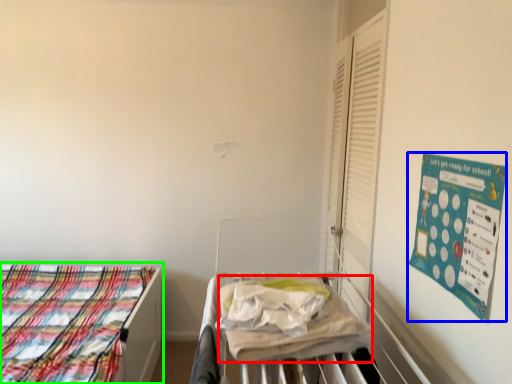
Question: Based on their relative distances, which object is farther from blanket (highlighted by a red box)? Choose from poster (highlighted by a blue box) and bed (highlighted by a green box).

Choices:
 (A) poster
 (B) bed

Answer: (B)